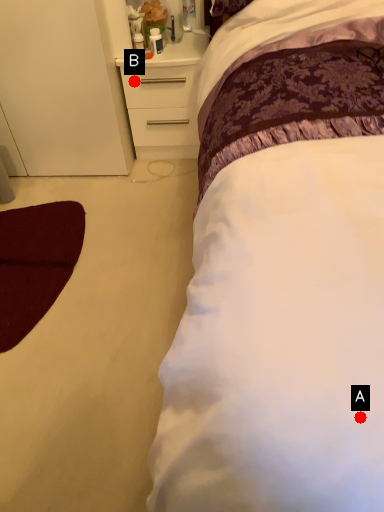
Question: Two points are circled on the image, labeled by A and B beside each circle. Which of the following is the closest to the observer?

Choices:
 (A) A is closer
 (B) B is closer

Answer: (A)